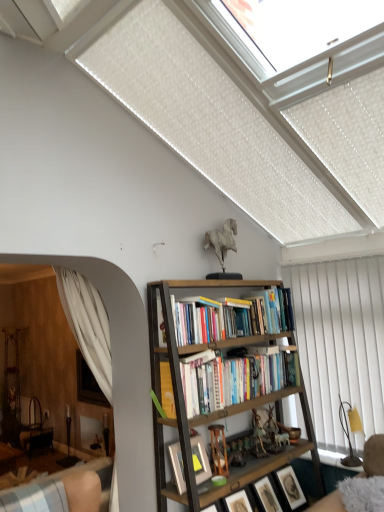
Measure the distance between wooden picture frame at lower center, which is the 2th picture frame from left to right, and camera.

A distance of 8.77 feet exists between wooden picture frame at lower center, which is the 2th picture frame from left to right, and camera.

At what (x,y) coordinates should I click in order to perform the action: click on wooden picture frame at lower center, the 2th picture frame from the right. Please return your answer as a coordinate pair (x, y). The image size is (384, 512). Looking at the image, I should click on (266, 495).

I want to click on matte black picture frame at center, which is counted as the first picture frame, starting from the left, so click(200, 459).

What do you see at coordinates (222, 241) in the screenshot?
I see `white matte horse at upper center, acting as the first toy starting from the top` at bounding box center [222, 241].

Locate an element on the screen. white vertical blinds at right is located at coordinates (340, 341).

At what (x,y) coordinates should I click in order to perform the action: click on wooden picture frame at lower center, the 2th picture frame from the right. Please return your answer as a coordinate pair (x, y). This screenshot has width=384, height=512. Looking at the image, I should click on (266, 495).

Considering the sizes of metallic gold figurine at center, which is the first toy from bottom to top, and white plastic window at upper center in the image, is metallic gold figurine at center, which is the first toy from bottom to top, bigger or smaller than white plastic window at upper center?

In the image, metallic gold figurine at center, which is the first toy from bottom to top, appears to be smaller than white plastic window at upper center.

Does point (263, 413) come behind point (258, 48)?

Yes, point (263, 413) is behind point (258, 48).

Does metallic gold figurine at center, placed as the 2th toy when sorted from left to right, turn towards white plastic window at upper center?

No, metallic gold figurine at center, placed as the 2th toy when sorted from left to right, does not turn towards white plastic window at upper center.

Does metallic gold figurine at center, which is the first toy from bottom to top, have a lesser width compared to white plastic window at upper center?

Correct, the width of metallic gold figurine at center, which is the first toy from bottom to top, is less than that of white plastic window at upper center.

Is matte black picture frame at center, which is counted as the first picture frame, starting from the left, next to white vertical blinds at right?

matte black picture frame at center, which is counted as the first picture frame, starting from the left, is not next to white vertical blinds at right, and they're not touching.

You are a GUI agent. You are given a task and a screenshot of the screen. Output one action in this format:
    pyautogui.click(x=<x>, y=<y>)
    Task: Click on the curtain above the matte black picture frame at center, which is counted as the first picture frame, starting from the left (from a real-world perspective)
    
    Given the screenshot: What is the action you would take?
    pyautogui.click(x=340, y=341)

Considering the sizes of objects matte black picture frame at center, which is counted as the first picture frame, starting from the left, and white vertical blinds at right in the image provided, who is shorter, matte black picture frame at center, which is counted as the first picture frame, starting from the left, or white vertical blinds at right?

With less height is matte black picture frame at center, which is counted as the first picture frame, starting from the left.

What's the angular difference between matte black picture frame at center, which ranks as the 3th picture frame in right-to-left order, and white vertical blinds at right's facing directions?

97.1 degrees.

Is hardcover books at center positioned with its back to wooden picture frame at lower right, the third picture frame positioned from the left?

hardcover books at center is not turned away from wooden picture frame at lower right, the third picture frame positioned from the left.

Is hardcover books at center far from wooden picture frame at lower right, the third picture frame positioned from the left?

No, hardcover books at center is in close proximity to wooden picture frame at lower right, the third picture frame positioned from the left.

From the image's perspective, which object appears higher, hardcover books at center or wooden picture frame at lower right, the first picture frame from the right?

hardcover books at center is shown above in the image.

Which picture frame is the 2nd one when counting from the right side of the hardcover books at center? Please provide its 2D coordinates.

[(290, 488)]

Are white matte horse at upper center, acting as the first toy starting from the top, and hardcover books at center far apart?

No, white matte horse at upper center, acting as the first toy starting from the top, is in close proximity to hardcover books at center.

Can we say white matte horse at upper center, positioned as the 2th toy in right-to-left order, lies outside hardcover books at center?

Yes.

From a real-world perspective, between white matte horse at upper center, acting as the first toy starting from the top, and hardcover books at center, who is vertically higher?

white matte horse at upper center, acting as the first toy starting from the top, from a real-world perspective.

Identify the location of toy above the hardcover books at center (from a real-world perspective). This screenshot has width=384, height=512. (222, 241).

Consider the image. From the image's perspective, which is below, white plastic window at upper center or metallic gold figurine at center, acting as the first toy starting from the right?

metallic gold figurine at center, acting as the first toy starting from the right, from the image's perspective.

Is point (339, 27) in front of point (255, 435)?

Yes, it is.

From a real-world perspective, which is physically below, white plastic window at upper center or metallic gold figurine at center, which is the first toy from bottom to top?

metallic gold figurine at center, which is the first toy from bottom to top, from a real-world perspective.

In the scene shown: Who is bigger, white plastic window at upper center or metallic gold figurine at center, placed as the 2th toy when sorted from top to bottom?

white plastic window at upper center is bigger.

Is white plastic window at upper center not inside hardcover books at center?

Absolutely, white plastic window at upper center is external to hardcover books at center.

Which of these two, white plastic window at upper center or hardcover books at center, is wider?

Wider between the two is white plastic window at upper center.

From a real-world perspective, is white plastic window at upper center below hardcover books at center?

No, from a real-world perspective, white plastic window at upper center is not under hardcover books at center.

Is point (296, 356) closer to camera compared to point (269, 508)?

That is False.

Looking at their sizes, would you say hardcover books at center is wider or thinner than wooden picture frame at lower center, the 2th picture frame from the right?

hardcover books at center is wider than wooden picture frame at lower center, the 2th picture frame from the right.

How far apart are hardcover books at center and wooden picture frame at lower center, the 2th picture frame from the right?

hardcover books at center is 27.45 inches away from wooden picture frame at lower center, the 2th picture frame from the right.

Is hardcover books at center in front of or behind wooden picture frame at lower center, which is the 2th picture frame from left to right, in the image?

Visually, hardcover books at center is located in front of wooden picture frame at lower center, which is the 2th picture frame from left to right.

The image size is (384, 512). I want to click on toy that is on the right side of white plastic window at upper center, so click(259, 433).

The image size is (384, 512). Find the location of `picture frame that is the 1st one below the white vertical blinds at right (from a real-world perspective)`. picture frame that is the 1st one below the white vertical blinds at right (from a real-world perspective) is located at coordinates (200, 459).

When comparing their distances from wooden picture frame at lower right, the first picture frame from the right, does matte black picture frame at center, which is counted as the first picture frame, starting from the left, or white matte horse at upper center, the second toy from the bottom, seem further?

Among the two, white matte horse at upper center, the second toy from the bottom, is located further to wooden picture frame at lower right, the first picture frame from the right.

Which object lies nearer to the anchor point wooden picture frame at lower center, the 2th picture frame from the right, matte black picture frame at center, which ranks as the 3th picture frame in right-to-left order, or white vertical blinds at right?

matte black picture frame at center, which ranks as the 3th picture frame in right-to-left order, lies closer to wooden picture frame at lower center, the 2th picture frame from the right, than the other object.

Looking at the image, which one is located closer to white plastic window at upper center, white matte horse at upper center, the second toy from the bottom, or wooden picture frame at lower center, the 2th picture frame from the right?

Among the two, white matte horse at upper center, the second toy from the bottom, is located nearer to white plastic window at upper center.

When comparing their distances from matte black picture frame at center, which is counted as the first picture frame, starting from the left, does wooden picture frame at lower center, the 2th picture frame from the right, or wooden picture frame at lower right, the third picture frame positioned from the left, seem closer?

Based on the image, wooden picture frame at lower center, the 2th picture frame from the right, appears to be nearer to matte black picture frame at center, which is counted as the first picture frame, starting from the left.

Which object lies nearer to the anchor point white vertical blinds at right, hardcover books at center or white matte horse at upper center, positioned as the 2th toy in right-to-left order?

Based on the image, hardcover books at center appears to be nearer to white vertical blinds at right.

Estimate the real-world distances between objects in this image. Which object is further from wooden picture frame at lower center, which is the 2th picture frame from left to right, wooden picture frame at lower right, the first picture frame from the right, or wooden bookcase at center?

Based on the image, wooden bookcase at center appears to be further to wooden picture frame at lower center, which is the 2th picture frame from left to right.

Based on the photo, when comparing their distances from white vertical blinds at right, does wooden bookcase at center or matte black picture frame at center, which ranks as the 3th picture frame in right-to-left order, seem closer?

wooden bookcase at center is closer to white vertical blinds at right.

Looking at the image, which one is located closer to metallic gold figurine at center, placed as the 2th toy when sorted from top to bottom, wooden picture frame at lower center, the 2th picture frame from the right, or wooden bookcase at center?

wooden picture frame at lower center, the 2th picture frame from the right.

The image size is (384, 512). Identify the location of curtain that lies between white matte horse at upper center, positioned as the 2th toy in right-to-left order, and wooden picture frame at lower right, the first picture frame from the right, from top to bottom. (340, 341).

At what (x,y) coordinates should I click in order to perform the action: click on bookcase between matte black picture frame at center, which ranks as the 3th picture frame in right-to-left order, and white vertical blinds at right from left to right. Please return your answer as a coordinate pair (x, y). Looking at the image, I should click on coord(225,404).

I want to click on toy that lies between white plastic window at upper center and metallic gold figurine at center, which is the first toy from bottom to top, from top to bottom, so click(x=222, y=241).

This screenshot has width=384, height=512. In order to click on bookcase between white plastic window at upper center and matte black picture frame at center, which ranks as the 3th picture frame in right-to-left order, in the up-down direction in this screenshot , I will do `click(225, 404)`.